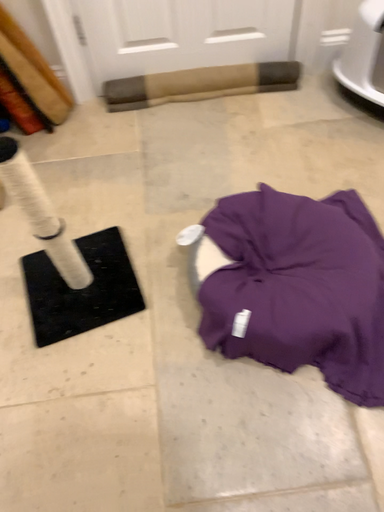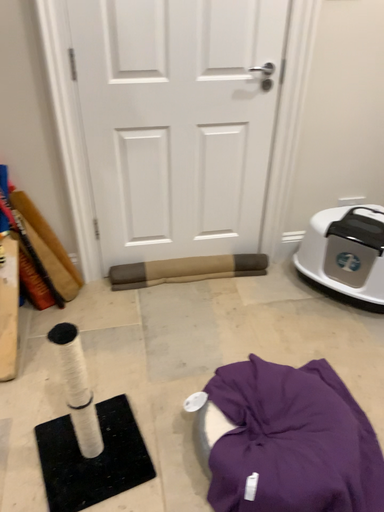
Question: How did the camera likely rotate when shooting the video?

Choices:
 (A) rotated downward
 (B) rotated upward

Answer: (B)